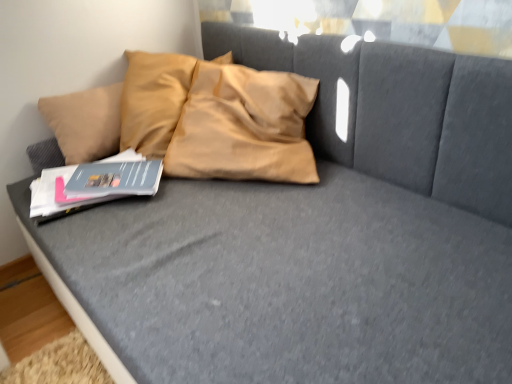
Locate an element on the screen. This screenshot has width=512, height=384. blank space situated above matte blue paperback book at left, arranged as the 2th paperback book when viewed from the back (from a real-world perspective) is located at coordinates (90, 178).